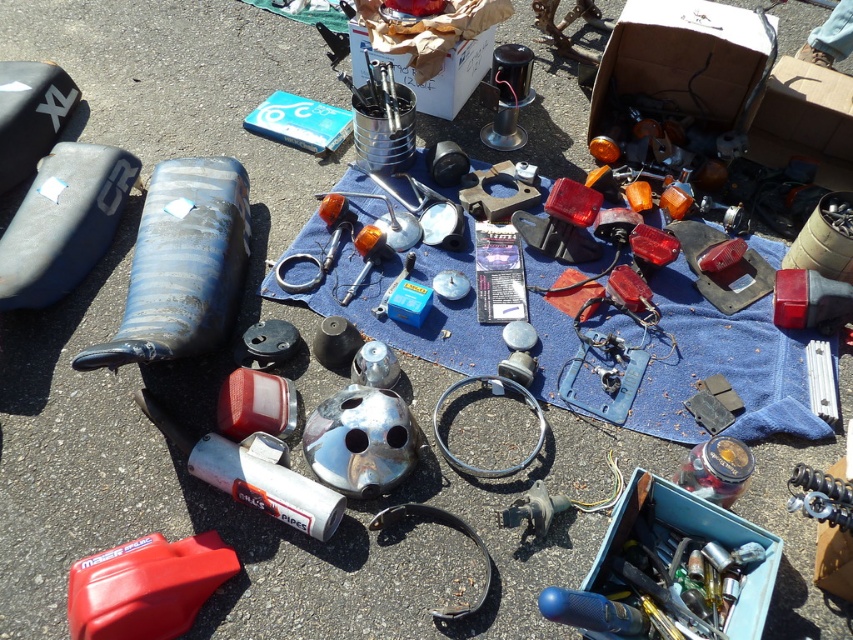
In the scene shown: Is blue fabric at center above metallic blue toolbox at lower right?

Yes, blue fabric at center is above metallic blue toolbox at lower right.

Who is more distant from viewer, (602, 310) or (712, 536)?

The point (602, 310) is more distant.

Identify the location of blue fabric at center. (721, 365).

Locate an element on the screen. The width and height of the screenshot is (853, 640). metallic blue toolbox at lower right is located at coordinates (671, 570).

Does metallic blue toolbox at lower right appear under blue matte fuel tank at left?

Yes.

What do you see at coordinates (671, 570) in the screenshot?
I see `metallic blue toolbox at lower right` at bounding box center [671, 570].

Locate an element on the screen. The image size is (853, 640). metallic blue toolbox at lower right is located at coordinates (671, 570).

Does blue fabric at center have a greater height compared to blue matte fuel tank at left?

Yes.

Between blue fabric at center and blue matte fuel tank at left, which one has less height?

blue matte fuel tank at left is shorter.

Does point (585, 266) lie behind point (190, 259)?

Yes, point (585, 266) is farther from viewer.

Identify the location of blue fabric at center. This screenshot has height=640, width=853. (721, 365).